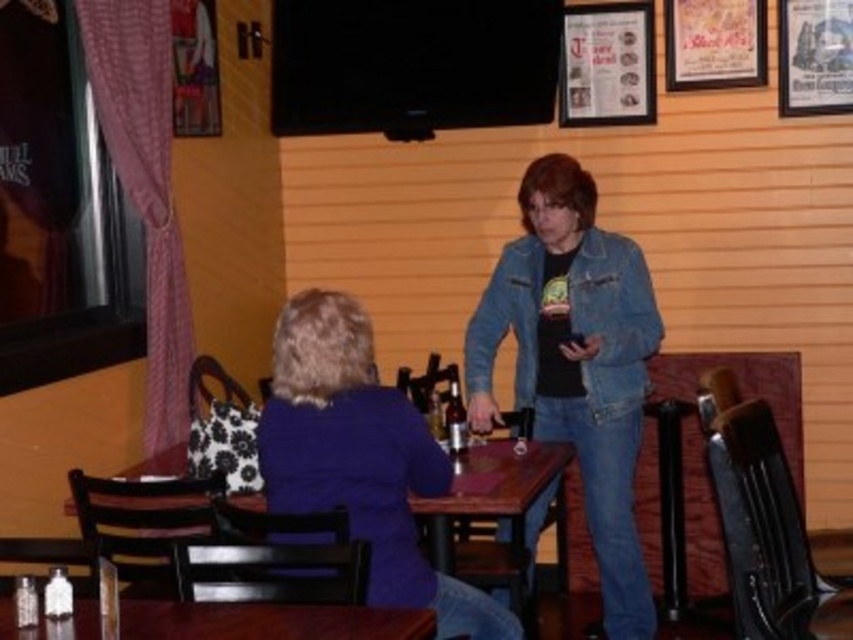
Consider the image. You are a photographer trying to capture both the denim jacket at center and the purple matte jacket at center in a single shot. Which jacket will appear closer to the camera in the photo?

The denim jacket at center will appear closer to the camera because it is positioned further to the viewer than the purple matte jacket at center.

You are a photographer trying to capture a candid shot of the scene. You want to ensure that both points, point [434,509] and point [88,604], are in focus. Given that your camera has a depth of field that can only sharply focus on objects at one distance, which point should you focus on to maximize the chances of both being in acceptable focus?

You should focus on point [434,509] because it is closer to the camera than point [88,604]. By focusing on the closer point, the farther point may still be within the depth of field, resulting in both being acceptably sharp.

You are a waiter in a restaurant. You see a denim jacket at center and a wooden table at center. Which object is closer to the right side of the scene?

The denim jacket at center is to the right of the wooden table at center, so the denim jacket at center is closer to the right side of the scene.